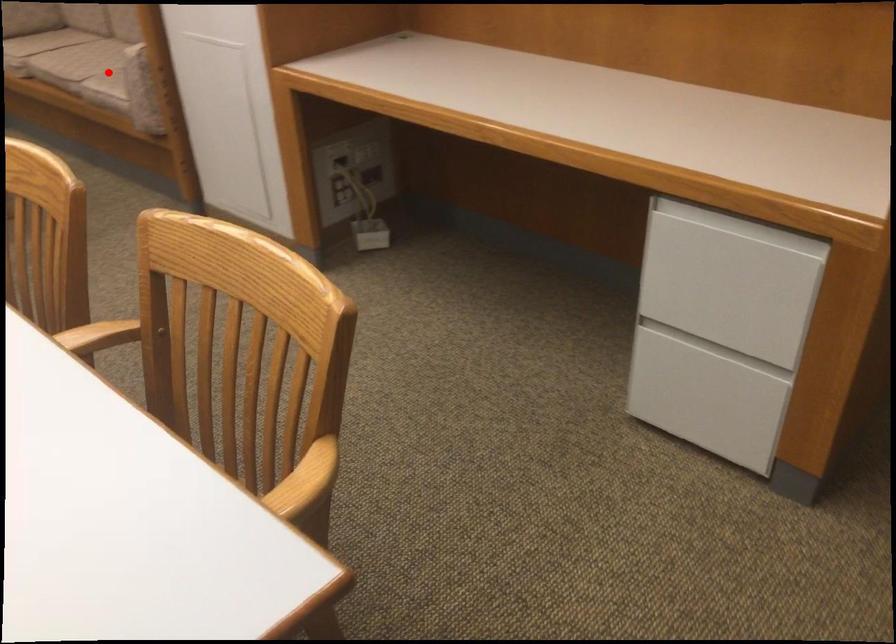
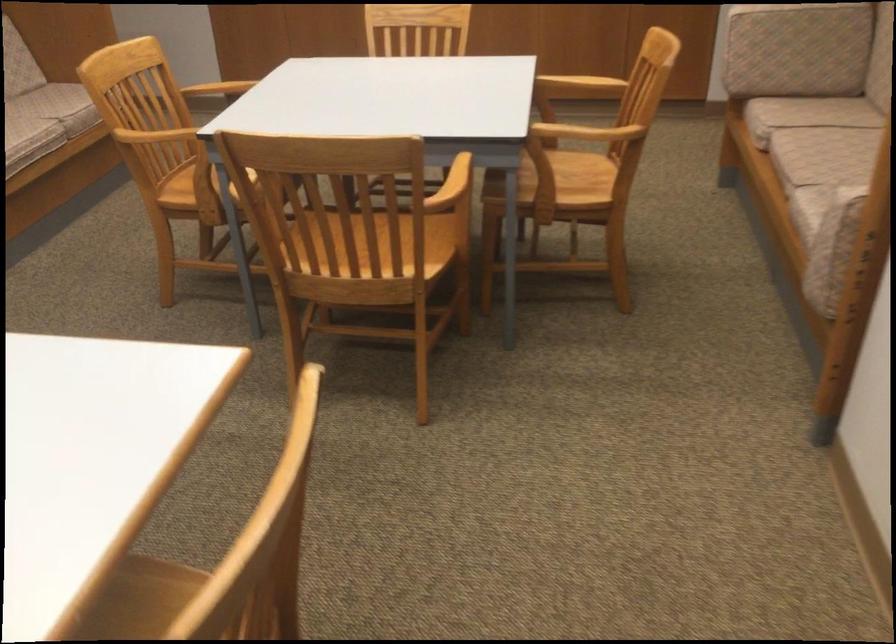
Find the pixel in the second image that matches the highlighted location in the first image.

(822, 190)